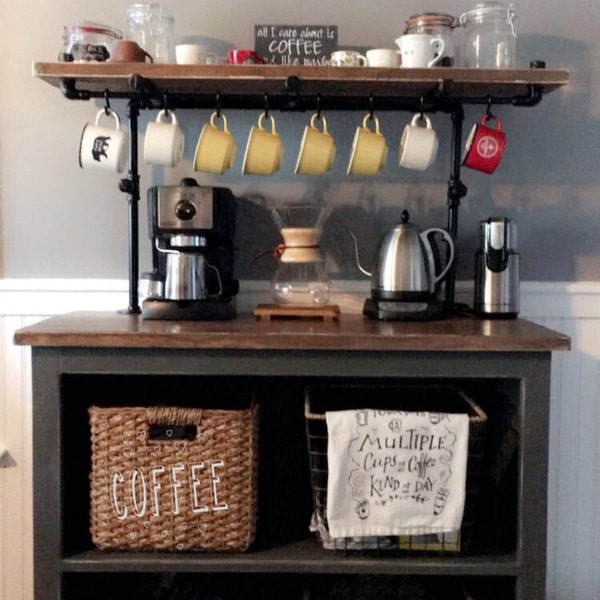
I want to click on handle to hold coffee pot, so click(x=218, y=273).